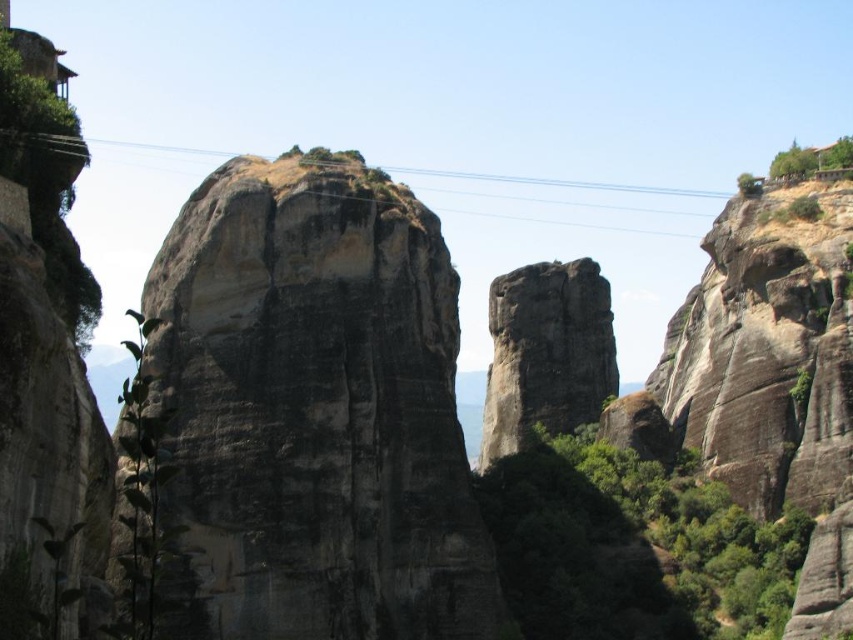
Who is more forward, (277, 236) or (659, 230)?

Point (277, 236) is in front.

In the scene shown: Does dark gray stone rock at center appear on the right side of black wire at center?

Yes, dark gray stone rock at center is to the right of black wire at center.

Which is behind, point (440, 602) or point (476, 180)?

The point (476, 180) is behind.

This screenshot has width=853, height=640. I want to click on dark gray stone rock at center, so click(314, 410).

From the picture: Can you confirm if dark gray stone rock at center is taller than dark gray rock formation at center?

Yes.

Looking at this image, who is lower down, dark gray stone rock at center or dark gray rock formation at center?

Positioned lower is dark gray rock formation at center.

Is point (300, 600) closer to viewer compared to point (537, 323)?

Yes, point (300, 600) is closer to viewer.

Locate an element on the screen. This screenshot has height=640, width=853. dark gray stone rock at center is located at coordinates (314, 410).

Between dark gray rock formation at center and black wire at center, which one is positioned higher?

black wire at center is above.

Is dark gray rock formation at center wider than black wire at center?

Incorrect, dark gray rock formation at center's width does not surpass black wire at center's.

Between point (608, 300) and point (425, 170), which one is positioned in front?

Positioned in front is point (608, 300).

I want to click on dark gray rock formation at center, so click(546, 353).